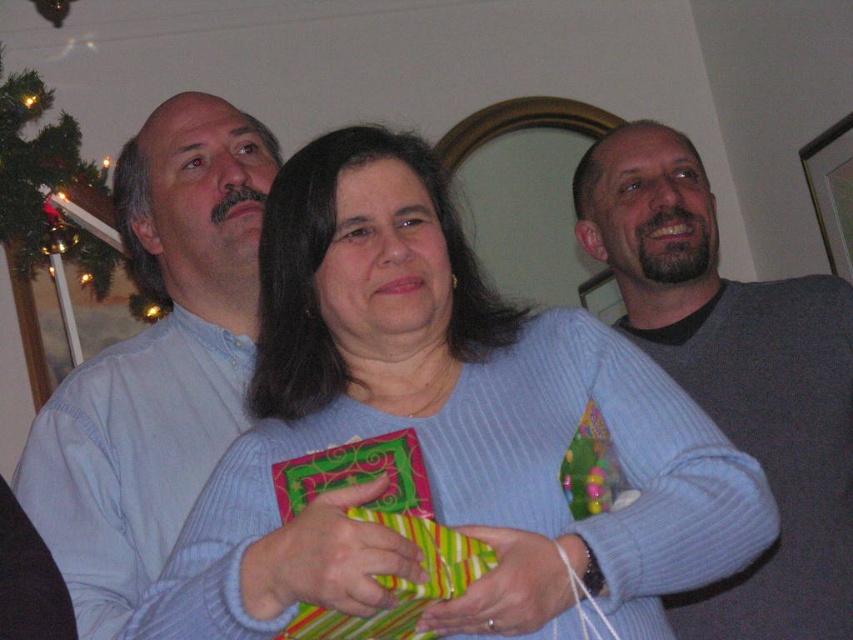
Is point (206, 428) farther from viewer compared to point (422, 506)?

That is True.

Can you confirm if light blue sweater at left is positioned to the left of green striped paper at center?

Correct, you'll find light blue sweater at left to the left of green striped paper at center.

The height and width of the screenshot is (640, 853). What do you see at coordinates (155, 362) in the screenshot?
I see `light blue sweater at left` at bounding box center [155, 362].

The height and width of the screenshot is (640, 853). Find the location of `light blue sweater at left`. light blue sweater at left is located at coordinates (155, 362).

Does blue ribbed sweater at center have a larger size compared to light blue sweater at left?

Indeed, blue ribbed sweater at center has a larger size compared to light blue sweater at left.

At what (x,y) coordinates should I click in order to perform the action: click on blue ribbed sweater at center. Please return your answer as a coordinate pair (x, y). Image resolution: width=853 pixels, height=640 pixels. Looking at the image, I should click on (447, 428).

Between point (378, 184) and point (26, 476), which one is positioned behind?

Positioned behind is point (26, 476).

Where is `blue ribbed sweater at center`? blue ribbed sweater at center is located at coordinates (447, 428).

Is gray ribbed sweater at upper right behind green striped paper at center?

Yes, it is behind green striped paper at center.

Between gray ribbed sweater at upper right and green striped paper at center, which one is positioned higher?

gray ribbed sweater at upper right

Between point (819, 419) and point (318, 458), which one is positioned in front?

Point (318, 458) is more forward.

Locate an element on the screen. The image size is (853, 640). gray ribbed sweater at upper right is located at coordinates (735, 376).